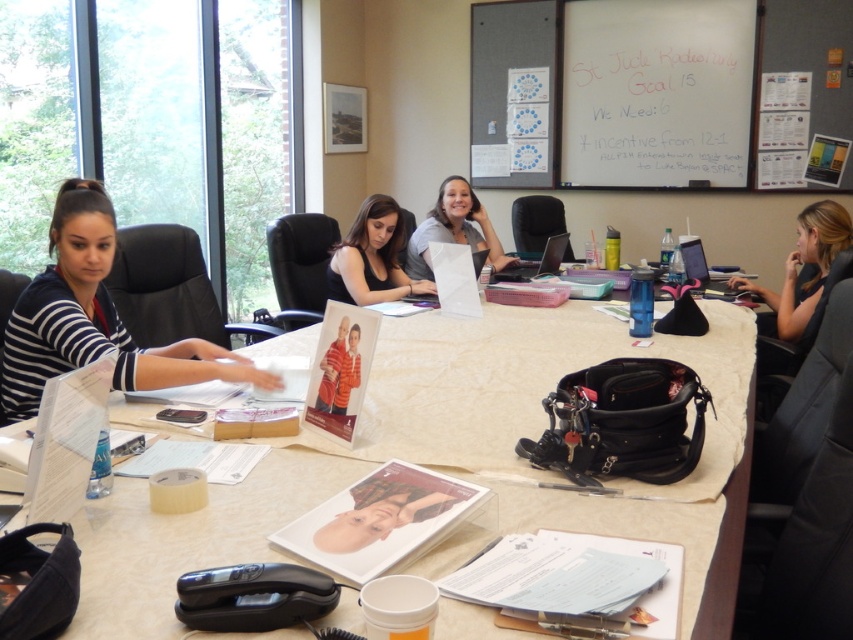
Can you confirm if whiteboard at upper center is positioned to the left of striped fabric shirt at left?

No, whiteboard at upper center is not to the left of striped fabric shirt at left.

Is point (730, 147) positioned behind point (77, 364)?

Yes.

At what (x,y) coordinates should I click in order to perform the action: click on whiteboard at upper center. Please return your answer as a coordinate pair (x, y). The image size is (853, 640). Looking at the image, I should click on (656, 92).

Where is `whiteboard at upper center`? whiteboard at upper center is located at coordinates (656, 92).

In the scene shown: Does matte black laptop at center appear under silver metallic laptop at center?

Yes, matte black laptop at center is below silver metallic laptop at center.

Is matte black laptop at center to the right of silver metallic laptop at center from the viewer's perspective?

Incorrect, matte black laptop at center is not on the right side of silver metallic laptop at center.

Locate an element on the screen. Image resolution: width=853 pixels, height=640 pixels. matte black laptop at center is located at coordinates (372, 257).

Is whiteboard at upper center above pink fabric laptop at right?

Indeed, whiteboard at upper center is positioned over pink fabric laptop at right.

Between point (747, 132) and point (694, 260), which one is positioned behind?

Positioned behind is point (747, 132).

Between point (630, 60) and point (697, 269), which one is positioned behind?

The point (630, 60) is more distant.

What are the coordinates of `whiteboard at upper center` in the screenshot? It's located at (656, 92).